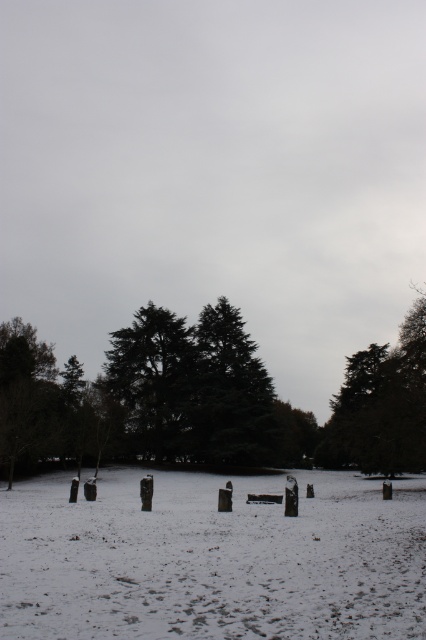
You are standing in a winter landscape and want to know how far the point at coordinates (x=399, y=381) is from you. Can you determine the distance?

The point at coordinates (x=399, y=381) is 50.37 meters away from you.

You are standing in the snowy field and want to walk towards the green textured tree at center. Which direction should you walk to avoid the green matte tree at right?

To reach the green textured tree at center while avoiding the green matte tree at right, walk towards the tree at center. The green matte tree at right is located below it, so moving towards the center tree would bypass the one at the right.

You are an environmental scientist assessing the health of trees in a winter landscape. You observe the green matte tree at right and the green textured tree at center. Which tree would you prioritize for further inspection based on their comparative thickness?

The green matte tree at right is thinner than the green textured tree at center, so you should prioritize the green matte tree at right for further inspection as its thinner structure may indicate potential health concerns.